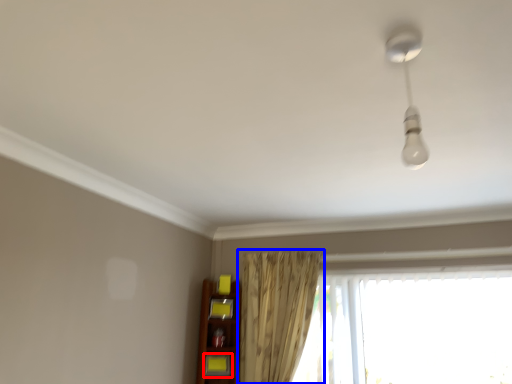
Question: Which object is further to the camera taking this photo, shelf (highlighted by a red box) or curtain (highlighted by a blue box)?

Choices:
 (A) shelf
 (B) curtain

Answer: (A)